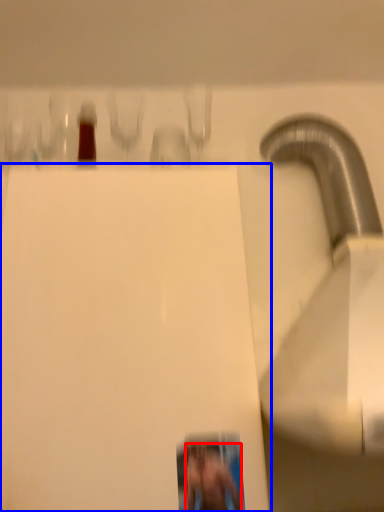
Question: Which object appears farthest to the camera in this image, person (highlighted by a red box) or wide (highlighted by a blue box)?

Choices:
 (A) person
 (B) wide

Answer: (A)